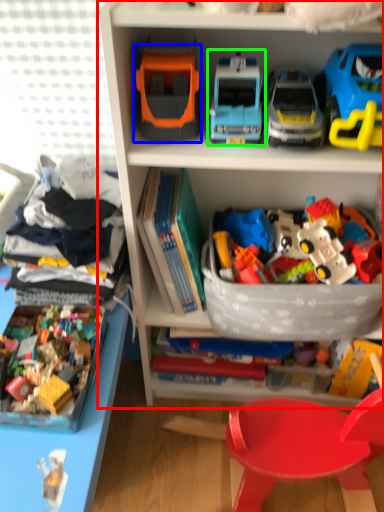
Question: Which object is the closest to the bookcase (highlighted by a red box)? Choose among these: toy (highlighted by a blue box) or toy (highlighted by a green box).

Choices:
 (A) toy
 (B) toy

Answer: (B)